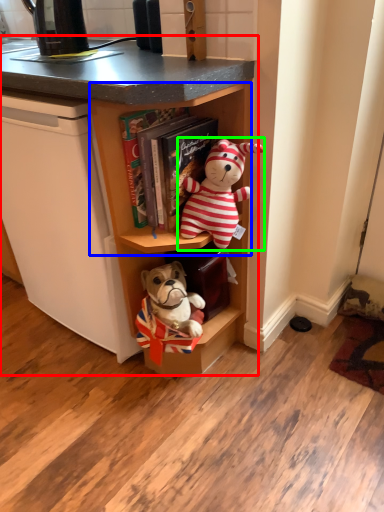
Question: Which object is positioned farthest from cabinetry (highlighted by a red box)? Select from cabinet (highlighted by a blue box) and toy (highlighted by a green box).

Choices:
 (A) cabinet
 (B) toy

Answer: (B)